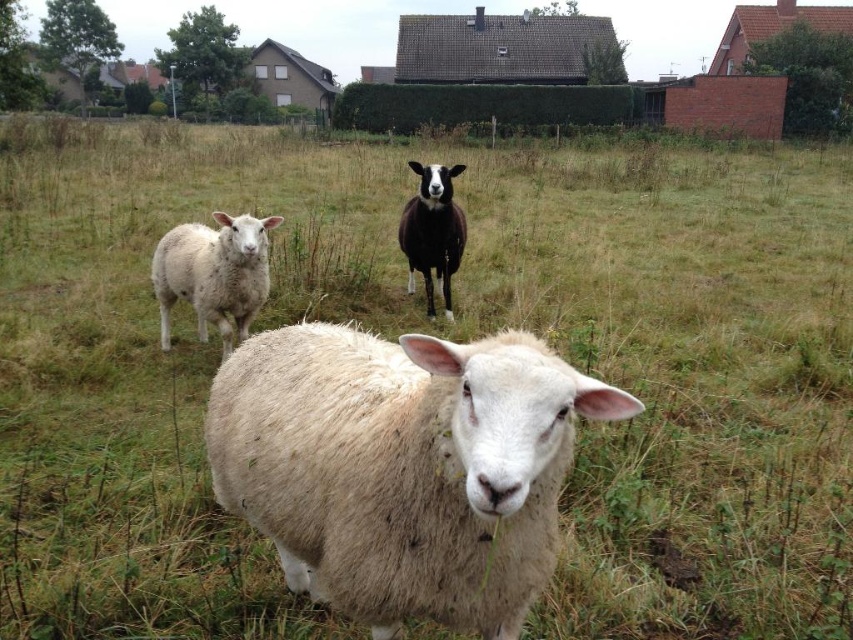
Question: Is fuzzy white sheep at center to the left of black woolen sheep at center from the viewer's perspective?

Choices:
 (A) no
 (B) yes

Answer: (B)

Question: Which of these objects is positioned closest to the black woolen sheep at center?

Choices:
 (A) fuzzy white sheep at center
 (B) white woolen sheep at left

Answer: (B)

Question: Which is nearer to the white woolen sheep at left?

Choices:
 (A) fuzzy white sheep at center
 (B) black woolen sheep at center

Answer: (B)

Question: Does white woolen sheep at left appear under black woolen sheep at center?

Choices:
 (A) no
 (B) yes

Answer: (B)

Question: Can you confirm if white woolen sheep at left is thinner than black woolen sheep at center?

Choices:
 (A) yes
 (B) no

Answer: (B)

Question: Which object is the closest to the black woolen sheep at center?

Choices:
 (A) white woolen sheep at left
 (B) fuzzy white sheep at center

Answer: (A)